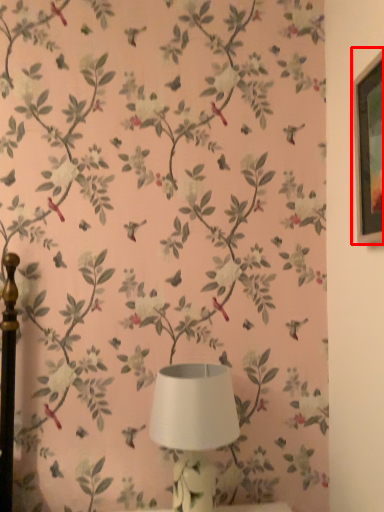
Question: From the image's perspective, where is picture frame (annotated by the red box) located relative to lamp?

Choices:
 (A) above
 (B) below

Answer: (A)